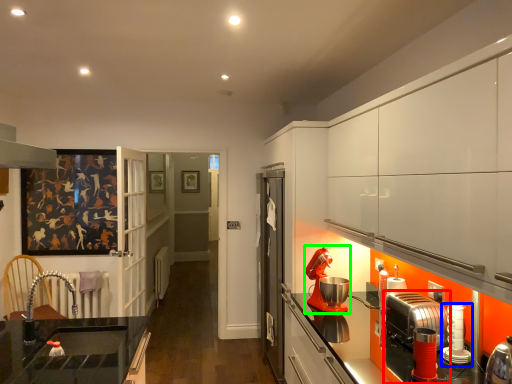
Question: Which is nearer to the kitchen appliance (highlighted by a red box)? kitchen appliance (highlighted by a blue box) or kitchen appliance (highlighted by a green box).

Choices:
 (A) kitchen appliance
 (B) kitchen appliance

Answer: (A)